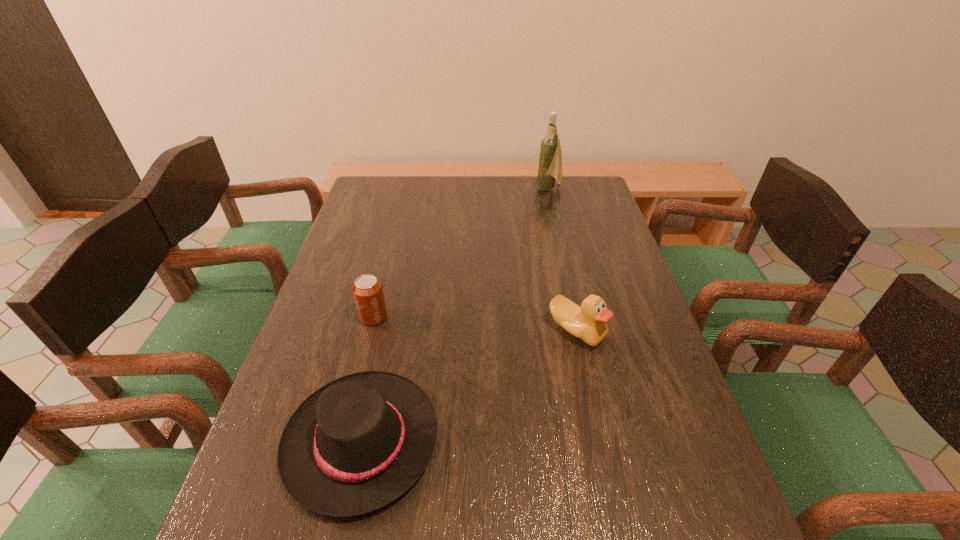
What are the coordinates of `wine bottle` in the screenshot? It's located at (550, 159).

This screenshot has width=960, height=540. Identify the location of the tallest object. (550, 159).

At what (x,y) coordinates should I click in order to perform the action: click on duck. Please return your answer as a coordinate pair (x, y). The image size is (960, 540). Looking at the image, I should click on pyautogui.click(x=588, y=322).

This screenshot has height=540, width=960. Identify the location of can. (367, 290).

At what (x,y) coordinates should I click in order to perform the action: click on the nearest object. Please return your answer as a coordinate pair (x, y). Looking at the image, I should click on (356, 444).

Identify the location of blank space located 0.060m on the front-facing side of the tallest object. (520, 189).

Locate an element on the screen. This screenshot has height=540, width=960. free space located 0.340m on the front-facing side of the tallest object is located at coordinates click(x=446, y=189).

Identify the location of free location located on the front-facing side of the tallest object. (516, 189).

The image size is (960, 540). In order to click on free location located at the beak of the duck in this screenshot , I will do `click(620, 530)`.

Where is `free location located 0.330m on the right of the can`? free location located 0.330m on the right of the can is located at coordinates (513, 316).